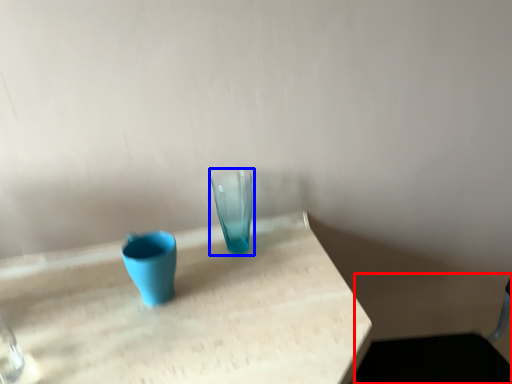
Question: Among these objects, which one is farthest to the camera, swivel chair (highlighted by a red box) or vase (highlighted by a blue box)?

Choices:
 (A) swivel chair
 (B) vase

Answer: (B)